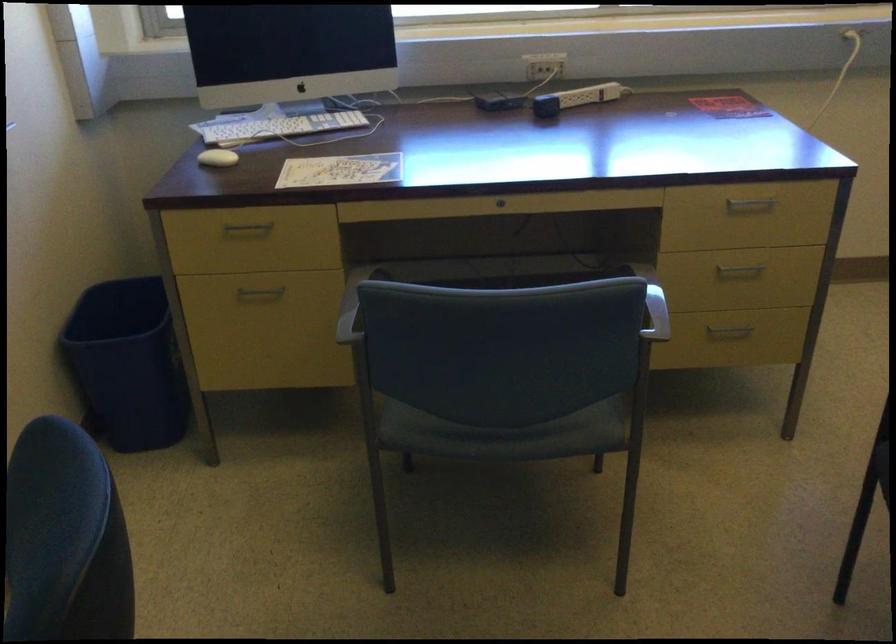
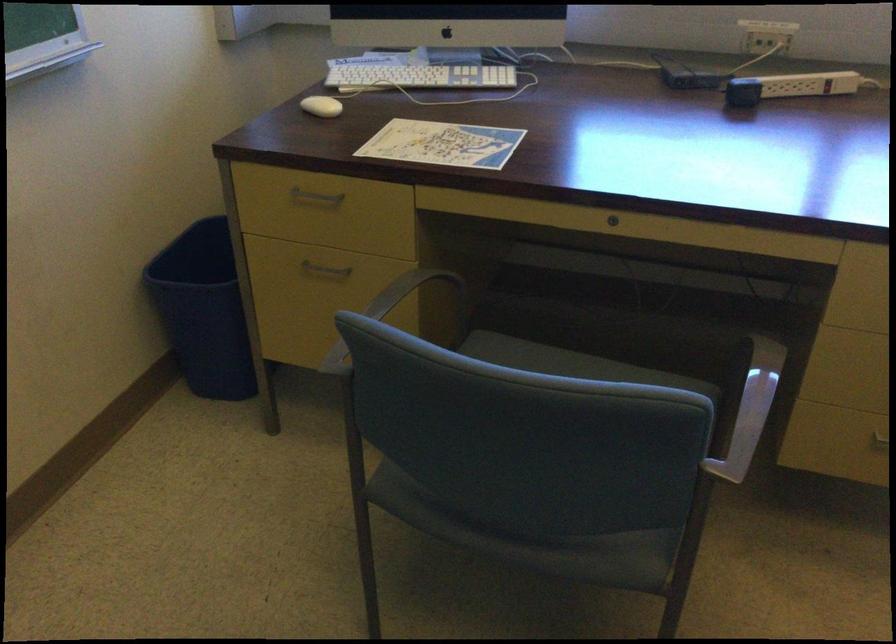
In the second image, find the point that corresponds to (247,228) in the first image.

(315, 196)